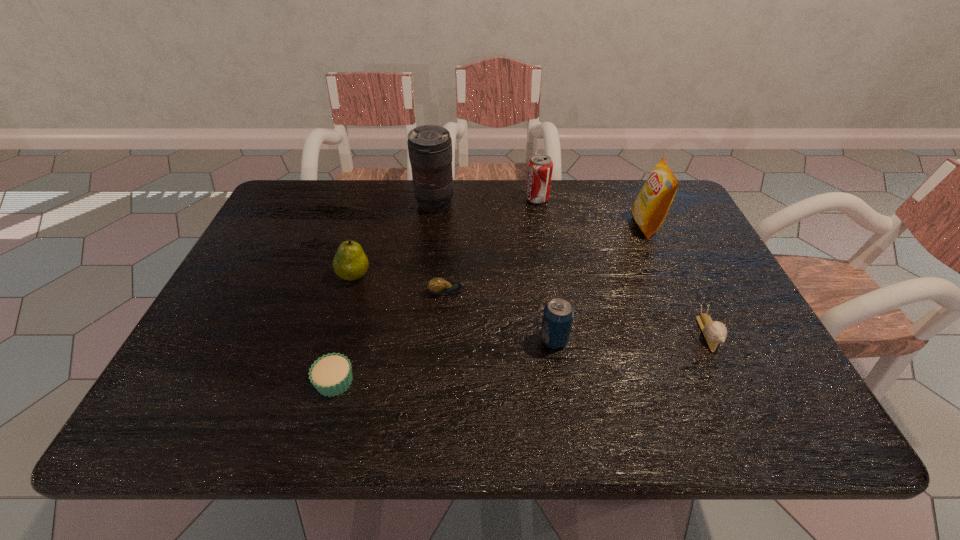
Locate an element on the screen. This screenshot has width=960, height=540. telephoto lens is located at coordinates (429, 146).

At what (x,y) coordinates should I click in order to perform the action: click on crisp (potato chip). Please return your answer as a coordinate pair (x, y). This screenshot has width=960, height=540. Looking at the image, I should click on (651, 206).

Find the location of a particular element. This screenshot has height=540, width=960. the farther pop soda is located at coordinates (540, 167).

Image resolution: width=960 pixels, height=540 pixels. What are the coordinates of `the taller pop soda` in the screenshot? It's located at (540, 167).

You are a GUI agent. You are given a task and a screenshot of the screen. Output one action in this format:
    pyautogui.click(x=<x>, y=<y>)
    Task: Click on the pear
    The width and height of the screenshot is (960, 540).
    Given the screenshot: What is the action you would take?
    pyautogui.click(x=350, y=263)

Locate an element on the screen. the nearer pop soda is located at coordinates (558, 314).

Identify the location of the farther escargot. Image resolution: width=960 pixels, height=540 pixels. (438, 286).

Find the location of a particular element. The height and width of the screenshot is (540, 960). the nearer escargot is located at coordinates (714, 332).

Locate an element on the screen. This screenshot has height=540, width=960. the nearest object is located at coordinates (331, 374).

Identify the location of vacant region located 0.250m on the side of the tallest object where the control switches are located. (426, 274).